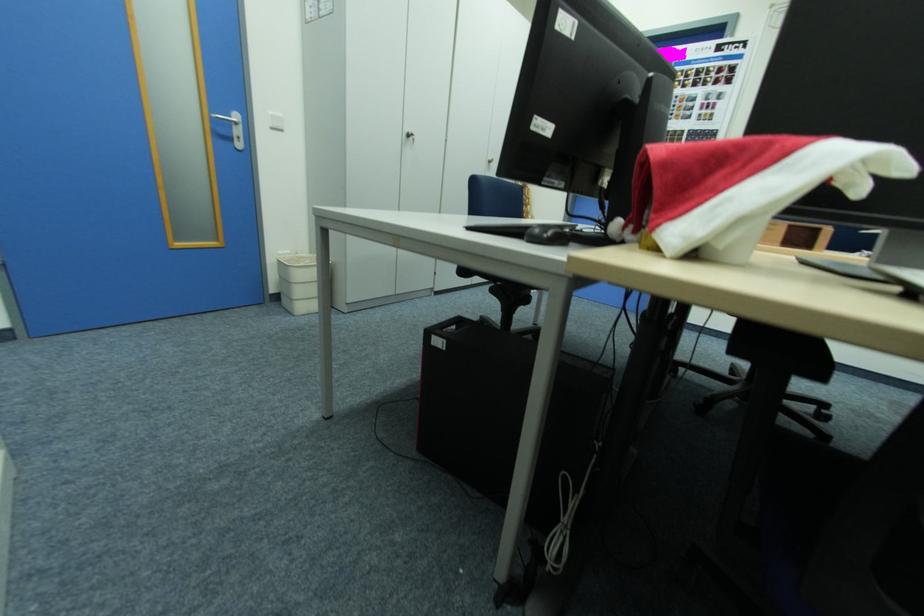
The height and width of the screenshot is (616, 924). In order to click on white trash can in this screenshot , I will do `click(298, 283)`.